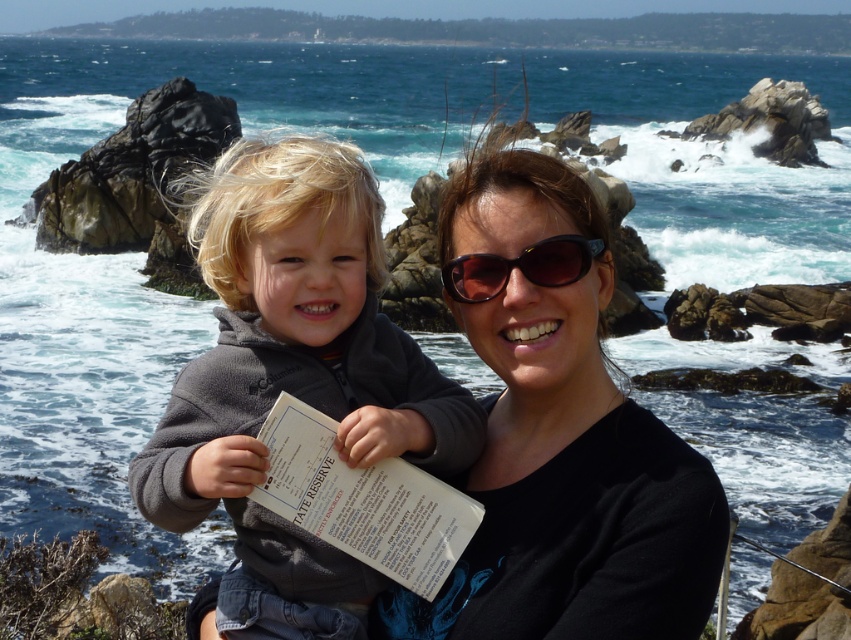
You are a photographer trying to capture a candid shot of the gray fleece jacket at left and the black plastic sunglasses at center. Since you want to highlight both items equally, which one should you zoom in on more to balance their sizes in the photo?

The gray fleece jacket at left occupies less space than the black plastic sunglasses at center, so you should zoom in more on the gray fleece jacket at left to make it appear larger in the photo and balance their sizes.

You are a photographer trying to capture the black matte sunglasses at upper center in the scene. If your camera has a crosshair targeting system with coordinates from 0 to 1 on both axes, where would you aim to center the shot?

You should aim for the coordinates point at 0.683 on the x axis and 0.657 on the y axis to center the black matte sunglasses at upper center.

You are standing at the rugged coastline in the image and want to place a small flag at point A and point B. If point A is at coordinates point (657, 620) and point B is at coordinates point (307, 173), which point is closer to you when you are facing the scene?

Point A at coordinates point (657, 620) is closer to you than point B at coordinates point (307, 173) because the description states that point (657, 620) is closer to the camera than point (307, 173).